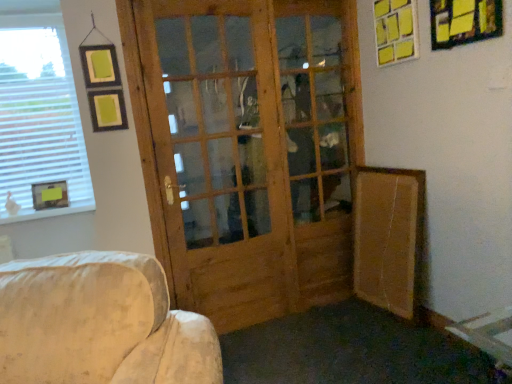
Question: From the image's perspective, relative to wooden picture frame at left, which appears as the 3th picture frame when viewed from the top, is yellow paper picture frame at upper right, which is counted as the second picture frame, starting from the top, above or below?

Choices:
 (A) below
 (B) above

Answer: (B)

Question: From a real-world perspective, is yellow paper picture frame at upper right, positioned as the 1th picture frame in front-to-back order, above or below wooden picture frame at left, which appears as the 3th picture frame when viewed from the top?

Choices:
 (A) below
 (B) above

Answer: (B)

Question: Considering the real-world distances, which object is closest to the yellow paper picture frame at upper right, placed as the 1th picture frame when sorted from right to left?

Choices:
 (A) wooden picture frame at left, the first picture frame positioned from the bottom
 (B) yellow paper picture frame at upper right, marked as the 2th picture frame in a front-to-back arrangement
 (C) natural wood screen door at center
 (D) white blinds at left
 (E) brown cardboard at lower right

Answer: (B)

Question: Which object is the closest to the yellow paper picture frame at upper right, positioned as the second picture frame in bottom-to-top order?

Choices:
 (A) white blinds at left
 (B) wooden picture frame at left, which ranks as the 3th picture frame in right-to-left order
 (C) yellow paper picture frame at upper right, marked as the 2th picture frame in a front-to-back arrangement
 (D) natural wood screen door at center
 (E) brown cardboard at lower right

Answer: (C)